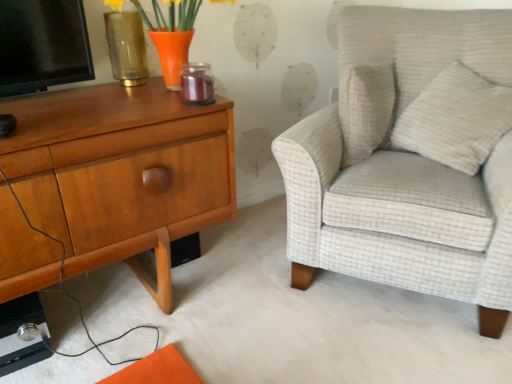
Question: In terms of width, does light beige textured armchair at right look wider or thinner when compared to woodennightstand at left?

Choices:
 (A) thin
 (B) wide

Answer: (B)

Question: From a real-world perspective, is light beige textured armchair at right above or below woodennightstand at left?

Choices:
 (A) above
 (B) below

Answer: (A)

Question: Which object is positioned farthest from the white textured pillow at upper right?

Choices:
 (A) woodennightstand at left
 (B) matte gold vase at upper left
 (C) orange glass vase at upper left
 (D) light beige textured armchair at right

Answer: (B)

Question: Estimate the real-world distances between objects in this image. Which object is farther from the orange glass vase at upper left?

Choices:
 (A) woodennightstand at left
 (B) white textured pillow at upper right
 (C) light beige textured armchair at right
 (D) matte gold vase at upper left

Answer: (B)